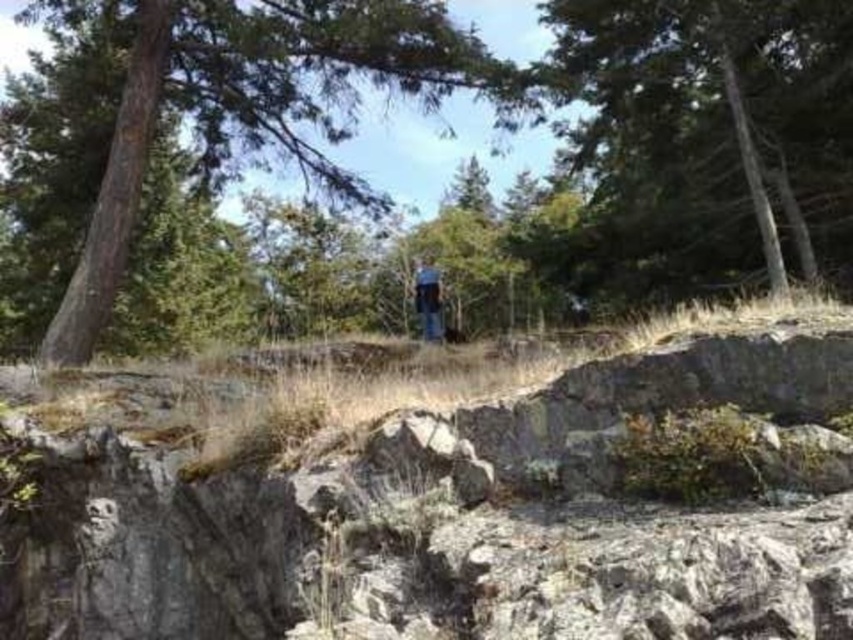
Question: Is green textured tree at upper center to the left of brown wood tree at upper center from the viewer's perspective?

Choices:
 (A) no
 (B) yes

Answer: (A)

Question: Which point is closer to the camera taking this photo?

Choices:
 (A) (422, 326)
 (B) (689, 6)
 (C) (428, 10)

Answer: (C)

Question: Considering the relative positions of brown wood tree at upper center and blue jeans at center in the image provided, where is brown wood tree at upper center located with respect to blue jeans at center?

Choices:
 (A) above
 (B) below

Answer: (A)

Question: Which object is farther from the camera taking this photo?

Choices:
 (A) brown wood tree at upper center
 (B) green textured tree at upper center

Answer: (A)

Question: Which of these objects is positioned farthest from the blue jeans at center?

Choices:
 (A) green textured tree at upper center
 (B) brown wood tree at upper center

Answer: (A)

Question: Considering the relative positions of green textured tree at upper center and brown wood tree at upper center in the image provided, where is green textured tree at upper center located with respect to brown wood tree at upper center?

Choices:
 (A) right
 (B) left

Answer: (A)